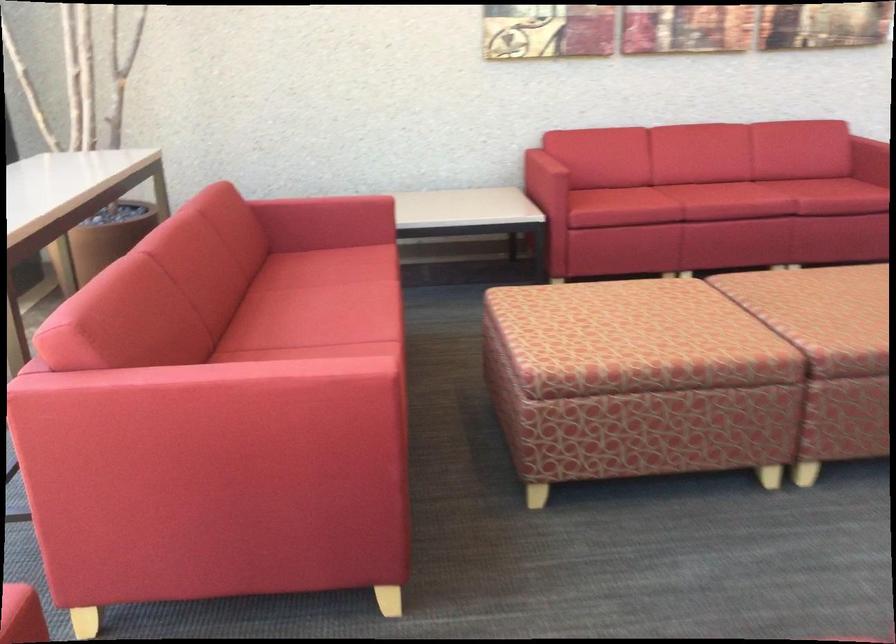
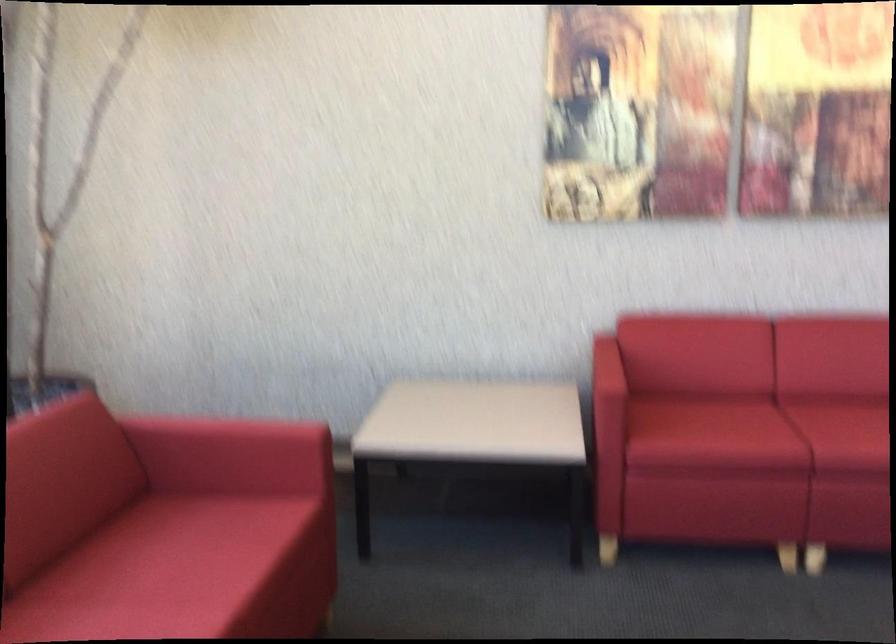
Find the pixel in the second image that matches [349,198] in the first image.

(261, 431)